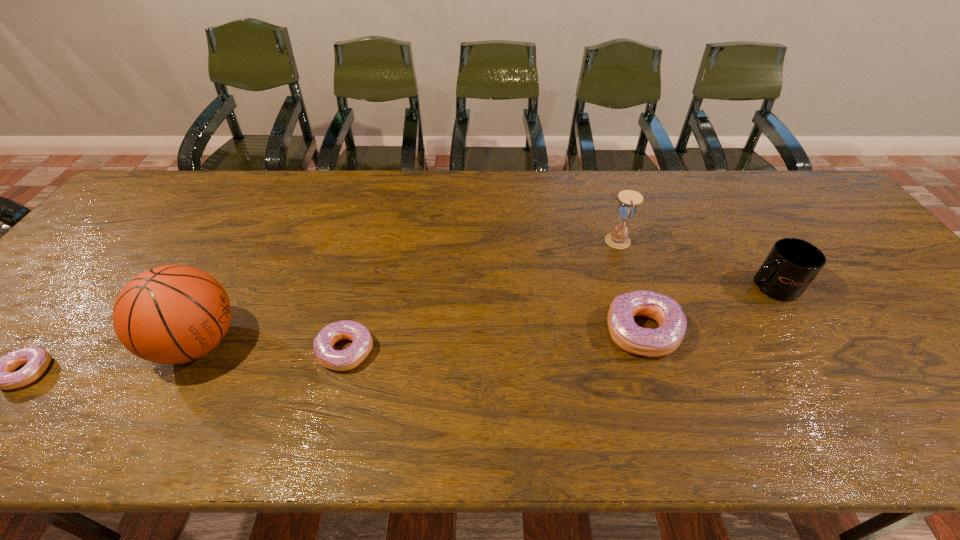
I want to click on blank area located on the back of the second doughnut from left to right, so click(368, 265).

Find the location of a particular element. This screenshot has height=540, width=960. blank space located on the left of the tallest doughnut is located at coordinates (504, 331).

The width and height of the screenshot is (960, 540). Find the location of `vacant space located 0.280m with the handle on the side of the third tallest object`. vacant space located 0.280m with the handle on the side of the third tallest object is located at coordinates (634, 287).

Locate an element on the screen. This screenshot has width=960, height=540. blank area located 0.370m with the handle on the side of the third tallest object is located at coordinates (599, 287).

Where is `free space located with the handle on the side of the third tallest object`? free space located with the handle on the side of the third tallest object is located at coordinates click(653, 287).

Locate an element on the screen. free space located 0.220m on the right of the hourglass is located at coordinates (708, 240).

Image resolution: width=960 pixels, height=540 pixels. I want to click on free space located on the right of the tallest object, so click(317, 343).

You are a GUI agent. You are given a task and a screenshot of the screen. Output one action in this format:
    pyautogui.click(x=<x>, y=<y>)
    Task: Click on the basketball that is at the near edge
    The height and width of the screenshot is (540, 960).
    Given the screenshot: What is the action you would take?
    pyautogui.click(x=172, y=314)

The image size is (960, 540). In order to click on vacant area at the far edge of the desktop in this screenshot , I will do `click(491, 204)`.

Where is `blank space at the near edge of the desktop`? Image resolution: width=960 pixels, height=540 pixels. blank space at the near edge of the desktop is located at coordinates (536, 369).